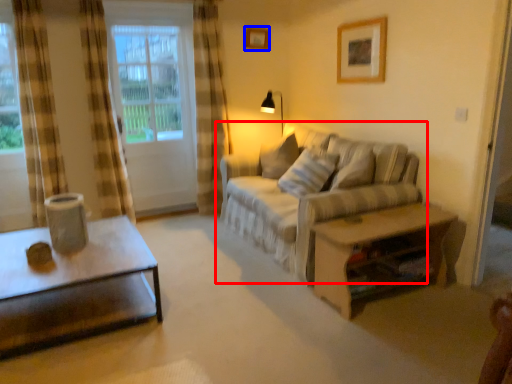
Question: Which point is further to the camera, studio couch (highlighted by a red box) or picture frame (highlighted by a blue box)?

Choices:
 (A) studio couch
 (B) picture frame

Answer: (B)